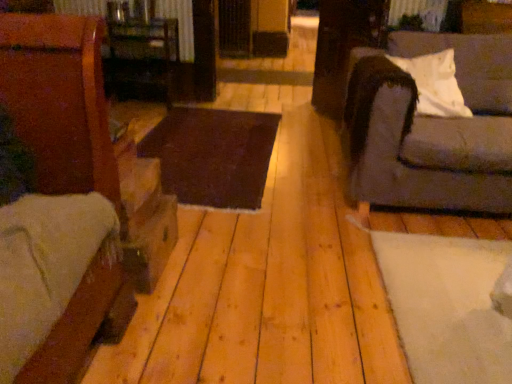
Identify the location of wooden table at center, the 1th table when ordered from top to bottom. Image resolution: width=512 pixels, height=384 pixels. (142, 58).

This screenshot has height=384, width=512. Find the location of `natural wood floor at center`. natural wood floor at center is located at coordinates (267, 287).

Image resolution: width=512 pixels, height=384 pixels. What do you see at coordinates (432, 127) in the screenshot? I see `gray fabric couch at right` at bounding box center [432, 127].

Where is `gray fabric couch at right`? gray fabric couch at right is located at coordinates (x=432, y=127).

This screenshot has width=512, height=384. Identify the location of brown wood table at center, marked as the second table in a top-to-bottom arrangement. (213, 155).

The width and height of the screenshot is (512, 384). Identify the location of white soft pillow at right. (435, 84).

From the image's perspective, which is above, gray fabric couch at right or natural wood floor at center?

gray fabric couch at right.

Are gray fabric couch at right and natural wood floor at center beside each other?

No, gray fabric couch at right is not with natural wood floor at center.

Considering the relative sizes of gray fabric couch at right and natural wood floor at center in the image provided, is gray fabric couch at right wider than natural wood floor at center?

No, gray fabric couch at right is not wider than natural wood floor at center.

Is gray fabric couch at right positioned in front of natural wood floor at center?

No, gray fabric couch at right is further to the viewer.

Find the location of a particular element. pillow that is on the right side of natural wood floor at center is located at coordinates (435, 84).

Considering the sizes of objects natural wood floor at center and white soft pillow at right in the image provided, who is taller, natural wood floor at center or white soft pillow at right?

white soft pillow at right is taller.

From a real-world perspective, is natural wood floor at center positioned above or below white soft pillow at right?

In terms of real-world spatial position, natural wood floor at center is below white soft pillow at right.

Which of these two, natural wood floor at center or white soft pillow at right, is bigger?

natural wood floor at center.

Who is shorter, brown wood table at center, marked as the second table in a top-to-bottom arrangement, or natural wood floor at center?

Standing shorter between the two is brown wood table at center, marked as the second table in a top-to-bottom arrangement.

From the image's perspective, between brown wood table at center, marked as the second table in a top-to-bottom arrangement, and natural wood floor at center, which one is located above?

brown wood table at center, marked as the second table in a top-to-bottom arrangement, appears higher in the image.

Looking at their sizes, would you say brown wood table at center, the first table in the bottom-to-top sequence, is wider or thinner than natural wood floor at center?

Clearly, brown wood table at center, the first table in the bottom-to-top sequence, has less width compared to natural wood floor at center.

Is brown wood table at center, marked as the second table in a top-to-bottom arrangement, positioned with its back to natural wood floor at center?

Yes.

Could you tell me if wooden table at center, the 1th table when ordered from top to bottom, is facing brown wood table at center, the first table in the bottom-to-top sequence?

No.

Is wooden table at center, the 1th table when ordered from top to bottom, next to brown wood table at center, the first table in the bottom-to-top sequence?

No, wooden table at center, the 1th table when ordered from top to bottom, is not next to brown wood table at center, the first table in the bottom-to-top sequence.

From the image's perspective, between wooden table at center, placed as the 2th table when sorted from bottom to top, and brown wood table at center, marked as the second table in a top-to-bottom arrangement, which one is located above?

wooden table at center, placed as the 2th table when sorted from bottom to top.

Could brown wood table at center, the first table in the bottom-to-top sequence, be considered to be inside wooden table at center, the 1th table when ordered from top to bottom?

No, brown wood table at center, the first table in the bottom-to-top sequence, is located outside of wooden table at center, the 1th table when ordered from top to bottom.

Is wooden table at center, placed as the 2th table when sorted from bottom to top, completely or partially outside of gray fabric couch at right?

Yes, wooden table at center, placed as the 2th table when sorted from bottom to top, is outside of gray fabric couch at right.

From the image's perspective, which is below, wooden table at center, placed as the 2th table when sorted from bottom to top, or gray fabric couch at right?

gray fabric couch at right is shown below in the image.

Is wooden table at center, the 1th table when ordered from top to bottom, looking in the opposite direction of gray fabric couch at right?

No, wooden table at center, the 1th table when ordered from top to bottom, is not facing away from gray fabric couch at right.

How different are the orientations of brown wood table at center, marked as the second table in a top-to-bottom arrangement, and gray fabric couch at right in degrees?

brown wood table at center, marked as the second table in a top-to-bottom arrangement, and gray fabric couch at right are facing 2.79 degrees away from each other.

From a real-world perspective, which object stands above the other?

gray fabric couch at right.

Can gray fabric couch at right be found inside brown wood table at center, marked as the second table in a top-to-bottom arrangement?

Actually, gray fabric couch at right is outside brown wood table at center, marked as the second table in a top-to-bottom arrangement.

Is brown wood table at center, the first table in the bottom-to-top sequence, placed right next to wooden table at center, the 1th table when ordered from top to bottom?

No, brown wood table at center, the first table in the bottom-to-top sequence, is not next to wooden table at center, the 1th table when ordered from top to bottom.

Is brown wood table at center, marked as the second table in a top-to-bottom arrangement, completely or partially outside of wooden table at center, placed as the 2th table when sorted from bottom to top?

Yes.

Considering the sizes of objects brown wood table at center, the first table in the bottom-to-top sequence, and wooden table at center, placed as the 2th table when sorted from bottom to top, in the image provided, who is shorter, brown wood table at center, the first table in the bottom-to-top sequence, or wooden table at center, placed as the 2th table when sorted from bottom to top,?

Standing shorter between the two is brown wood table at center, the first table in the bottom-to-top sequence.

This screenshot has height=384, width=512. I want to click on studio couch located above the natural wood floor at center (from a real-world perspective), so (432, 127).

The height and width of the screenshot is (384, 512). I want to click on plywood in front of the white soft pillow at right, so click(267, 287).

When comparing their distances from natural wood floor at center, does white soft pillow at right or brown wood table at center, marked as the second table in a top-to-bottom arrangement, seem further?

The object further to natural wood floor at center is white soft pillow at right.

Looking at the image, which one is located closer to white soft pillow at right, brown wood table at center, marked as the second table in a top-to-bottom arrangement, or natural wood floor at center?

Based on the image, natural wood floor at center appears to be nearer to white soft pillow at right.

When comparing their distances from white soft pillow at right, does gray fabric couch at right or natural wood floor at center seem further?

Among the two, natural wood floor at center is located further to white soft pillow at right.

Which object lies further to the anchor point gray fabric couch at right, wooden table at center, placed as the 2th table when sorted from bottom to top, or white soft pillow at right?

wooden table at center, placed as the 2th table when sorted from bottom to top, is further to gray fabric couch at right.

When comparing their distances from white soft pillow at right, does natural wood floor at center or wooden table at center, placed as the 2th table when sorted from bottom to top, seem further?

Among the two, wooden table at center, placed as the 2th table when sorted from bottom to top, is located further to white soft pillow at right.

Which object lies further to the anchor point wooden table at center, placed as the 2th table when sorted from bottom to top, brown wood table at center, marked as the second table in a top-to-bottom arrangement, or natural wood floor at center?

Among the two, natural wood floor at center is located further to wooden table at center, placed as the 2th table when sorted from bottom to top.

Which object lies further to the anchor point gray fabric couch at right, natural wood floor at center or wooden table at center, the 1th table when ordered from top to bottom?

Among the two, wooden table at center, the 1th table when ordered from top to bottom, is located further to gray fabric couch at right.

Based on their spatial positions, is brown wood table at center, the first table in the bottom-to-top sequence, or wooden table at center, placed as the 2th table when sorted from bottom to top, further from gray fabric couch at right?

Among the two, wooden table at center, placed as the 2th table when sorted from bottom to top, is located further to gray fabric couch at right.

Find the location of `pillow between natural wood floor at center and wooden table at center, the 1th table when ordered from top to bottom, from front to back`. pillow between natural wood floor at center and wooden table at center, the 1th table when ordered from top to bottom, from front to back is located at coordinates (435, 84).

This screenshot has height=384, width=512. In order to click on pillow between natural wood floor at center and gray fabric couch at right from left to right in this screenshot , I will do `click(435, 84)`.

The width and height of the screenshot is (512, 384). Identify the location of plywood between brown wood table at center, the first table in the bottom-to-top sequence, and gray fabric couch at right. (267, 287).

Locate an element on the screen. The width and height of the screenshot is (512, 384). pillow situated between wooden table at center, the 1th table when ordered from top to bottom, and gray fabric couch at right from left to right is located at coordinates (435, 84).